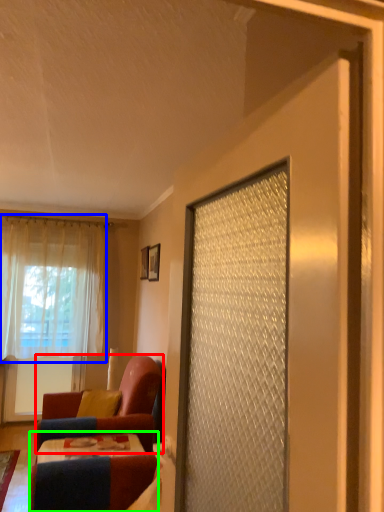
Question: Which object is the farthest from chair (highlighted by a red box)? Choose among these: curtain (highlighted by a blue box) or table (highlighted by a green box).

Choices:
 (A) curtain
 (B) table

Answer: (A)